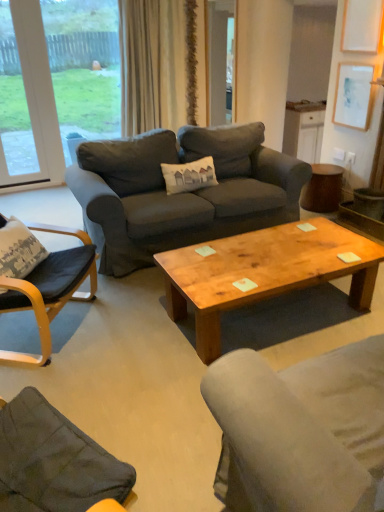
Question: Is black leather chair at left bigger or smaller than dark gray fabric couch at center?

Choices:
 (A) big
 (B) small

Answer: (B)

Question: From the image's perspective, is black leather chair at left positioned above or below dark gray fabric couch at center?

Choices:
 (A) below
 (B) above

Answer: (A)

Question: Estimate the real-world distances between objects in this image. Which object is farther from the black leather chair at left?

Choices:
 (A) wooden coffee table at center
 (B) brown wooden side table at right
 (C) white paper at upper right
 (D) dark gray fabric couch at center
 (E) beige fabric curtain at upper center

Answer: (E)

Question: Which object is positioned closest to the white plastic window at upper left, acting as the 1th window starting from the left?

Choices:
 (A) transparent glass window at upper left, which is the 1th window in right-to-left order
 (B) wooden coffee table at center
 (C) beige fabric curtain at upper center
 (D) brown wooden side table at right
 (E) black leather chair at left

Answer: (A)